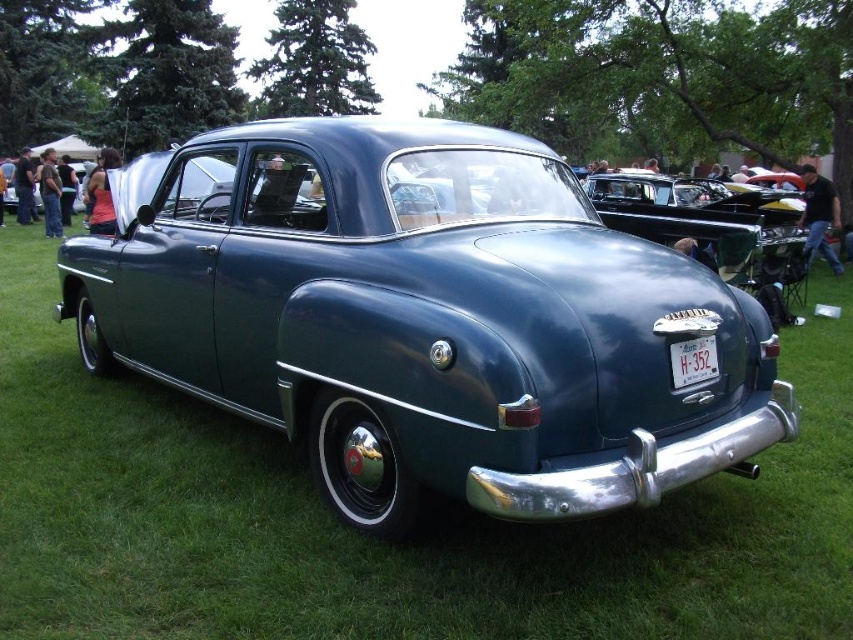
Question: Is metallic blue car at center thinner than white plastic license plate at center?

Choices:
 (A) yes
 (B) no

Answer: (B)

Question: Is metallic blue car at center to the left of white plastic license plate at center from the viewer's perspective?

Choices:
 (A) yes
 (B) no

Answer: (A)

Question: Can you confirm if metallic blue car at center is positioned to the left of white plastic license plate at center?

Choices:
 (A) yes
 (B) no

Answer: (A)